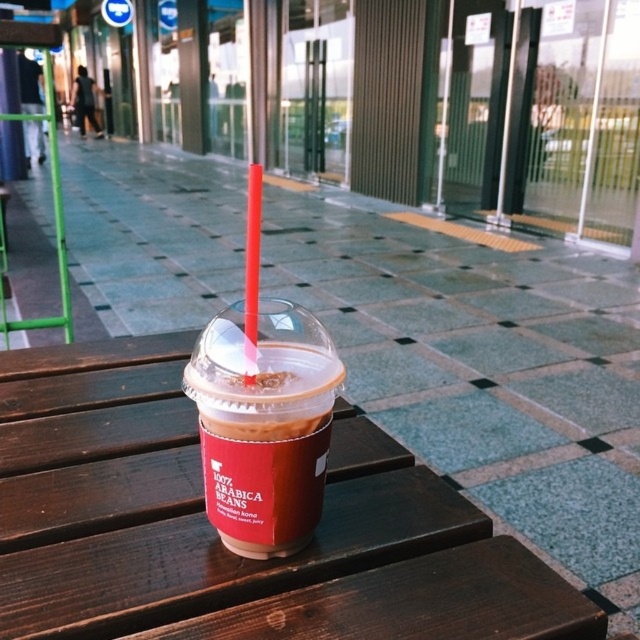
Question: Is brown wooden picnic table at center to the left of matte plastic cup at center from the viewer's perspective?

Choices:
 (A) no
 (B) yes

Answer: (B)

Question: Which point is closer to the camera?

Choices:
 (A) (253, 582)
 (B) (241, 488)

Answer: (B)

Question: Which point is farther to the camera?

Choices:
 (A) tap(259, 476)
 (B) tap(353, 593)

Answer: (B)

Question: Is brown wooden picnic table at center above matte plastic cup at center?

Choices:
 (A) yes
 (B) no

Answer: (B)

Question: Is brown wooden picnic table at center smaller than matte plastic cup at center?

Choices:
 (A) no
 (B) yes

Answer: (A)

Question: Which point is closer to the camera?

Choices:
 (A) brown wooden picnic table at center
 (B) matte plastic cup at center

Answer: (A)